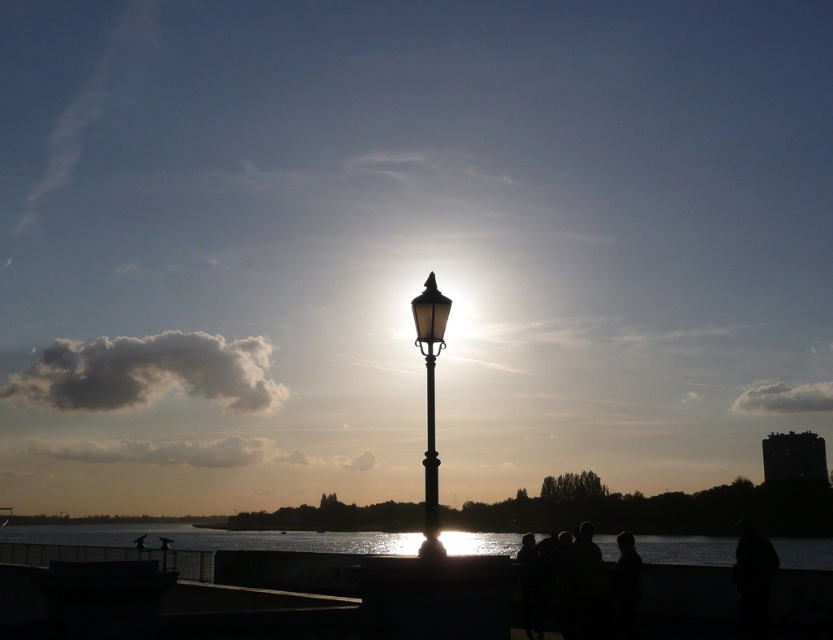
Question: Which object is positioned closest to the black polished metal streetlight at center?

Choices:
 (A) metallic pole at center
 (B) reflective water at lower center

Answer: (A)

Question: Estimate the real-world distances between objects in this image. Which object is closer to the reflective water at lower center?

Choices:
 (A) metallic pole at center
 (B) black polished metal streetlight at center

Answer: (B)

Question: Which point is closer to the camera taking this photo?

Choices:
 (A) (427, 486)
 (B) (607, 557)
 (C) (431, 358)

Answer: (A)

Question: Does reflective water at lower center appear on the left side of black polished metal streetlight at center?

Choices:
 (A) yes
 (B) no

Answer: (A)

Question: Does reflective water at lower center have a smaller size compared to black polished metal streetlight at center?

Choices:
 (A) no
 (B) yes

Answer: (A)

Question: Can you confirm if reflective water at lower center is wider than black polished metal streetlight at center?

Choices:
 (A) no
 (B) yes

Answer: (B)